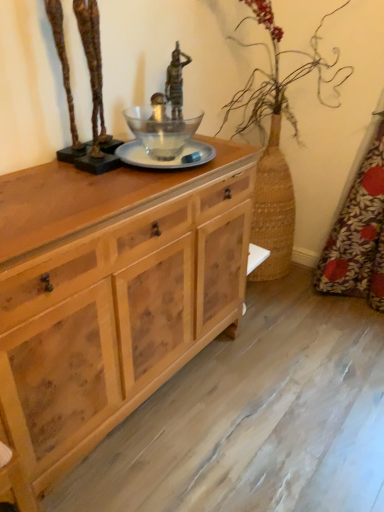
The height and width of the screenshot is (512, 384). Find the location of `vacant space in front of floral fabric at right`. vacant space in front of floral fabric at right is located at coordinates (352, 330).